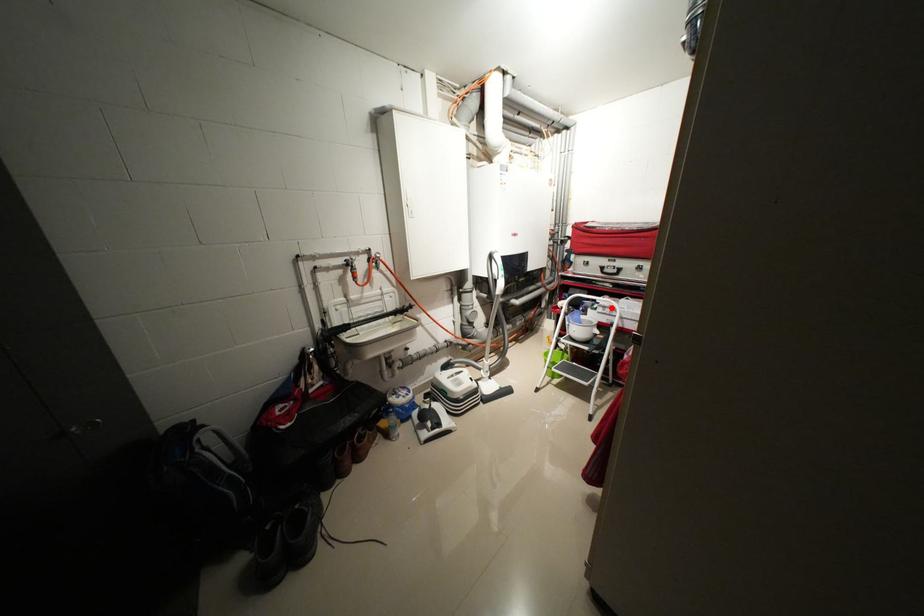
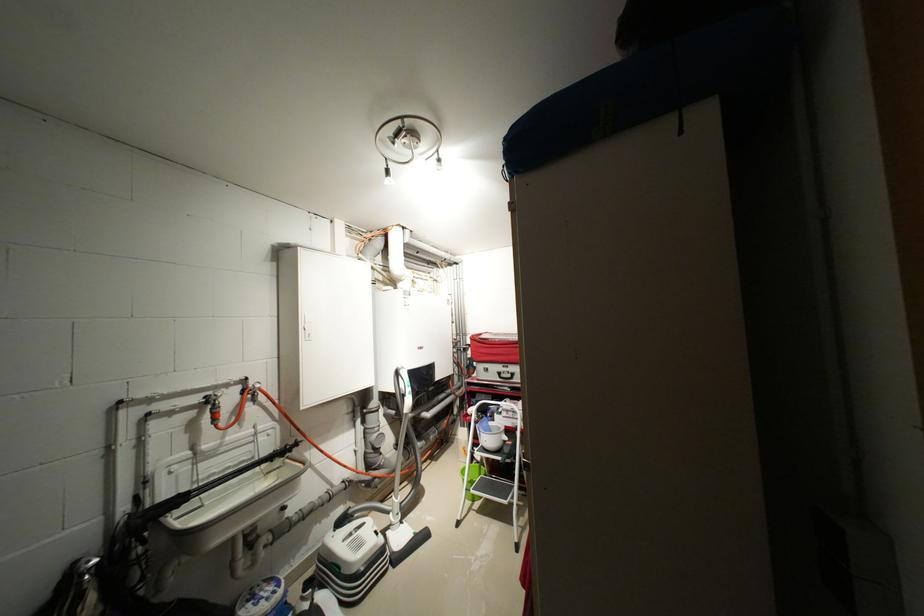
Question: I am providing you with two images of the same scene from different viewpoints. A red point is shown in image1. For the corresponding object point in image2, is it positioned nearer or farther from the camera?

Choices:
 (A) Nearer
 (B) Farther

Answer: (B)